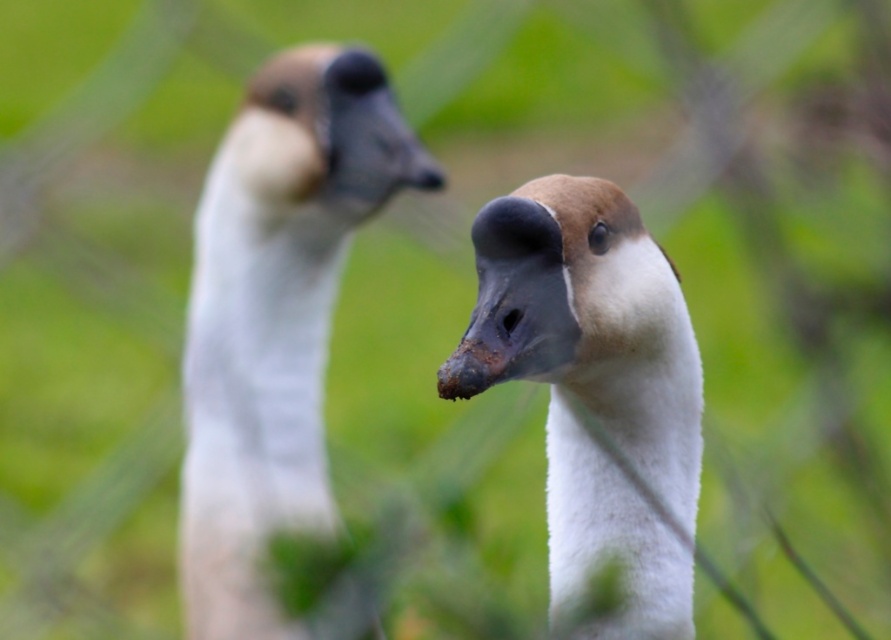
Can you confirm if white feathered neck at center is thinner than brown matte beak at center?

Incorrect, white feathered neck at center's width is not less than brown matte beak at center's.

Does white feathered neck at center come in front of brown matte beak at center?

That is True.

Is point (251, 300) positioned behind point (423, 186)?

No, it is in front of (423, 186).

Where is `white feathered neck at center`? This screenshot has width=891, height=640. white feathered neck at center is located at coordinates click(258, 369).

Is point (599, 348) in front of point (316, 44)?

Yes, point (599, 348) is in front of point (316, 44).

Can you confirm if brown matte goose head at center is positioned above brown matte goose head at upper left?

Actually, brown matte goose head at center is below brown matte goose head at upper left.

Is point (669, 344) more distant than point (369, 76)?

No, (669, 344) is in front of (369, 76).

This screenshot has width=891, height=640. Find the location of `brown matte goose head at center`. brown matte goose head at center is located at coordinates (563, 289).

Between white matte duck at center and brown matte beak at center, which one is positioned lower?

Positioned lower is white matte duck at center.

Is white matte duck at center to the left of brown matte beak at center from the viewer's perspective?

In fact, white matte duck at center is to the right of brown matte beak at center.

Is point (480, 221) farther from viewer compared to point (438, 186)?

No, it is not.

Where is `white matte duck at center`? white matte duck at center is located at coordinates (594, 387).